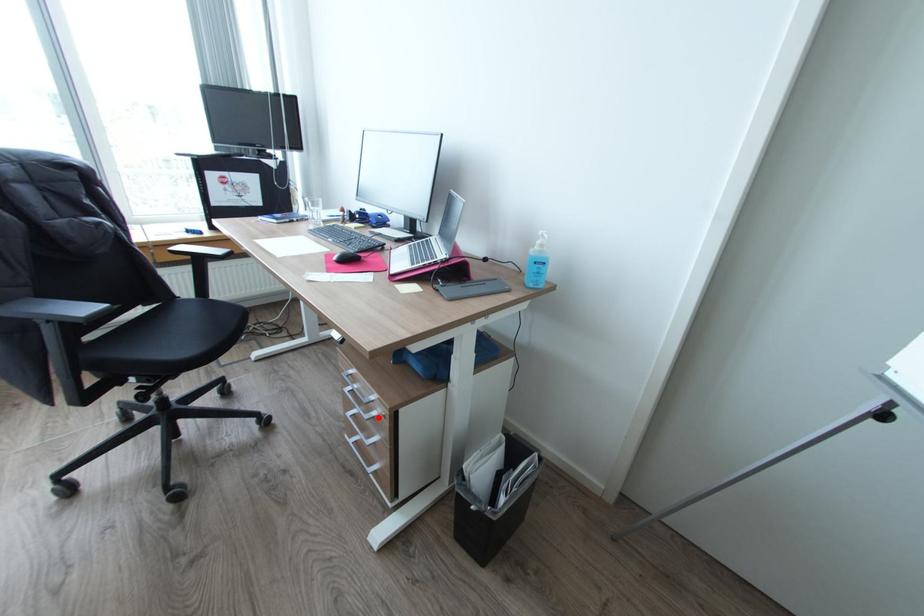
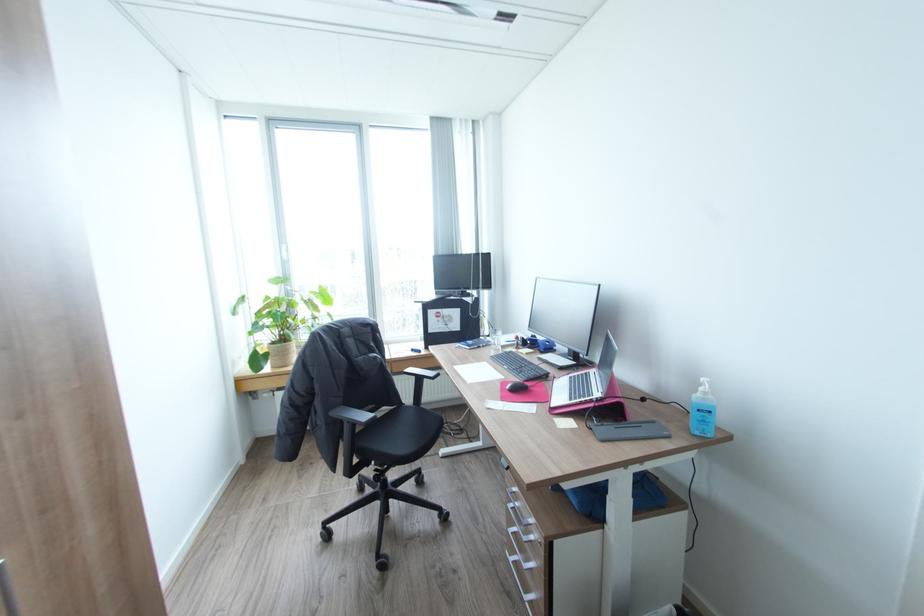
In the second image, find the point that corresponds to the highlighted location in the first image.

(536, 541)